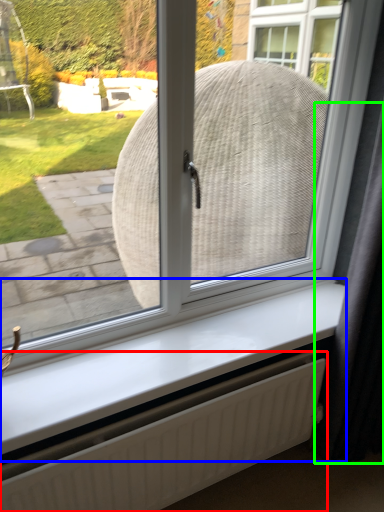
Question: Which object is the closest to the radiator (highlighted by a red box)? Choose among these: window sill (highlighted by a blue box) or curtain (highlighted by a green box).

Choices:
 (A) window sill
 (B) curtain

Answer: (A)